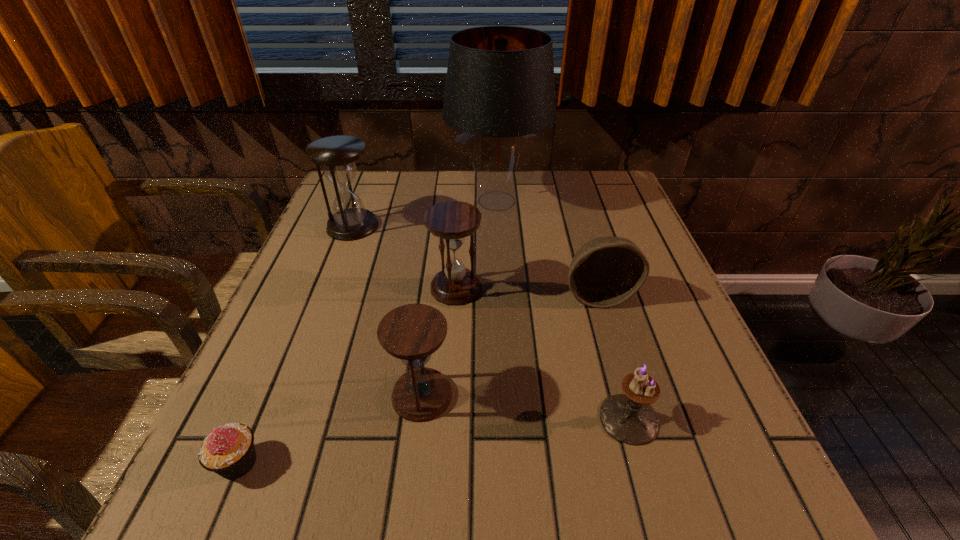
The image size is (960, 540). I want to click on lampshade, so click(500, 90).

Identify the location of the leftmost hourglass. The height and width of the screenshot is (540, 960). (337, 155).

Locate an element on the screen. The width and height of the screenshot is (960, 540). the second farthest hourglass is located at coordinates (452, 221).

Find the location of a particular element. the nearest hourglass is located at coordinates [x=412, y=333].

Find the location of a particular element. The image size is (960, 540). bowl is located at coordinates (605, 272).

You are a GUI agent. You are given a task and a screenshot of the screen. Output one action in this format:
    pyautogui.click(x=<x>, y=<y>)
    Task: Click on the second shortest object
    This screenshot has height=540, width=960.
    Given the screenshot: What is the action you would take?
    pyautogui.click(x=628, y=418)

At what (x,y) coordinates should I click in order to perform the action: click on cupcake. Please return your answer as a coordinate pair (x, y). The image size is (960, 540). Looking at the image, I should click on (229, 451).

Where is `vacant region located 0.300m on the front of the tallest object`? vacant region located 0.300m on the front of the tallest object is located at coordinates (503, 314).

Locate an element on the screen. free space located on the right of the leftmost hourglass is located at coordinates (515, 226).

Locate an element on the screen. free location located on the left of the second farthest hourglass is located at coordinates (324, 288).